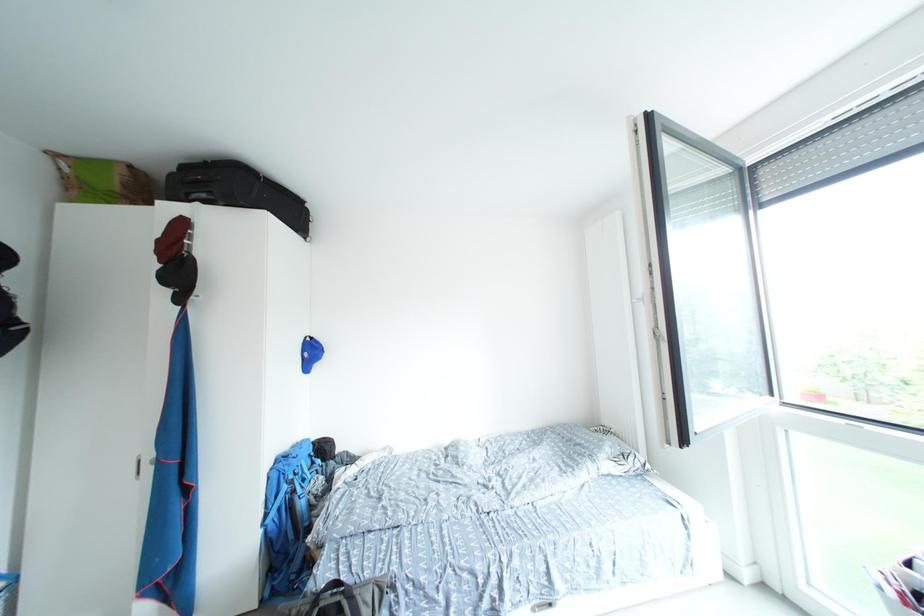
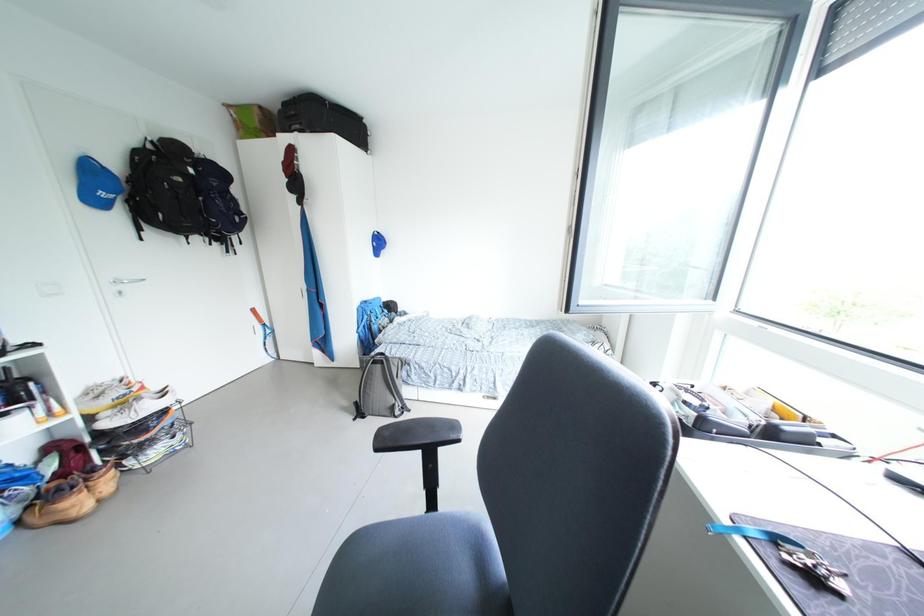
What movement of the cameraman would produce the second image?

The cameraman moved toward right, backward.